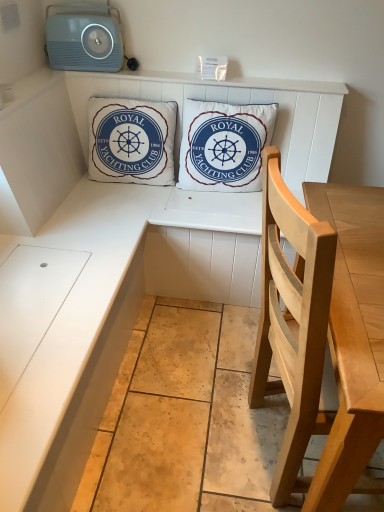
This screenshot has width=384, height=512. Describe the element at coordinates (131, 141) in the screenshot. I see `white cotton cushion at center, which ranks as the 2th pillow in right-to-left order` at that location.

The image size is (384, 512). What are the coordinates of `light wood chair at right` in the screenshot? It's located at (293, 324).

Describe the element at coordinates (293, 324) in the screenshot. Image resolution: width=384 pixels, height=512 pixels. I see `light wood chair at right` at that location.

In order to face light blue plastic stereo at upper left, should I rotate leftwards or rightwards?

You should rotate left by 14.283 degrees.

Locate an element on the screen. The width and height of the screenshot is (384, 512). white cotton cushion at center, the first pillow in the right-to-left sequence is located at coordinates (x=224, y=145).

Are light wood chair at right and white cotton cushion at center, which ranks as the 2th pillow in right-to-left order, making contact?

No, light wood chair at right is not in contact with white cotton cushion at center, which ranks as the 2th pillow in right-to-left order.

Could you tell me if light wood chair at right is facing white cotton cushion at center, which ranks as the 2th pillow in right-to-left order?

No, light wood chair at right is not turned towards white cotton cushion at center, which ranks as the 2th pillow in right-to-left order.

Is light wood chair at right bigger than white cotton cushion at center, marked as the 1th pillow in a left-to-right arrangement?

Yes, light wood chair at right is bigger than white cotton cushion at center, marked as the 1th pillow in a left-to-right arrangement.

Can you tell me how much light blue plastic stereo at upper left and white cotton cushion at center, the first pillow in the right-to-left sequence, differ in facing direction?

The facing directions of light blue plastic stereo at upper left and white cotton cushion at center, the first pillow in the right-to-left sequence, are 0.787 degrees apart.

Is light blue plastic stereo at upper left thinner than white cotton cushion at center, the first pillow in the right-to-left sequence?

Correct, the width of light blue plastic stereo at upper left is less than that of white cotton cushion at center, the first pillow in the right-to-left sequence.

Would you say light blue plastic stereo at upper left is a long distance from white cotton cushion at center, the first pillow in the right-to-left sequence?

light blue plastic stereo at upper left is actually quite close to white cotton cushion at center, the first pillow in the right-to-left sequence.

The width and height of the screenshot is (384, 512). Find the location of `stereo that is behind the white cotton cushion at center, the first pillow in the right-to-left sequence`. stereo that is behind the white cotton cushion at center, the first pillow in the right-to-left sequence is located at coordinates (84, 37).

Does point (52, 27) come closer to viewer compared to point (307, 377)?

No.

How distant is light blue plastic stereo at upper left from light wood chair at right?

light blue plastic stereo at upper left is 1.43 meters from light wood chair at right.

Looking at this image, is light blue plastic stereo at upper left oriented away from light wood chair at right?

No, light blue plastic stereo at upper left is not facing away from light wood chair at right.

Is light blue plastic stereo at upper left smaller than light wood chair at right?

Correct, light blue plastic stereo at upper left occupies less space than light wood chair at right.

Is light wood chair at right taller or shorter than white cotton cushion at center, the second pillow viewed from the left?

In the image, light wood chair at right appears to be taller than white cotton cushion at center, the second pillow viewed from the left.

Is light wood chair at right smaller than white cotton cushion at center, the first pillow in the right-to-left sequence?

No, light wood chair at right is not smaller than white cotton cushion at center, the first pillow in the right-to-left sequence.

Would you say light wood chair at right is to the left or to the right of white cotton cushion at center, the second pillow viewed from the left, in the picture?

Clearly, light wood chair at right is on the right of white cotton cushion at center, the second pillow viewed from the left, in the image.

Is the depth of light wood chair at right less than that of white cotton cushion at center, the first pillow in the right-to-left sequence?

Yes, it is in front of white cotton cushion at center, the first pillow in the right-to-left sequence.

What's the angular difference between light blue plastic stereo at upper left and white cotton cushion at center, marked as the 1th pillow in a left-to-right arrangement,'s facing directions?

The facing directions of light blue plastic stereo at upper left and white cotton cushion at center, marked as the 1th pillow in a left-to-right arrangement, are 2 degrees apart.

From a real-world perspective, which is physically below, light blue plastic stereo at upper left or white cotton cushion at center, which ranks as the 2th pillow in right-to-left order?

From a 3D spatial view, white cotton cushion at center, which ranks as the 2th pillow in right-to-left order, is below.

Are light blue plastic stereo at upper left and white cotton cushion at center, marked as the 1th pillow in a left-to-right arrangement, far apart?

Actually, light blue plastic stereo at upper left and white cotton cushion at center, marked as the 1th pillow in a left-to-right arrangement, are a little close together.

Image resolution: width=384 pixels, height=512 pixels. What are the coordinates of `the 1st pillow counting from the right side of the light blue plastic stereo at upper left` in the screenshot? It's located at (131, 141).

Does white cotton cushion at center, the second pillow viewed from the left, lie behind light blue plastic stereo at upper left?

No, white cotton cushion at center, the second pillow viewed from the left, is in front of light blue plastic stereo at upper left.

From the image's perspective, which one is positioned higher, white cotton cushion at center, the first pillow in the right-to-left sequence, or light blue plastic stereo at upper left?

light blue plastic stereo at upper left.

Considering the sizes of white cotton cushion at center, the first pillow in the right-to-left sequence, and light blue plastic stereo at upper left in the image, is white cotton cushion at center, the first pillow in the right-to-left sequence, bigger or smaller than light blue plastic stereo at upper left?

Considering their sizes, white cotton cushion at center, the first pillow in the right-to-left sequence, takes up more space than light blue plastic stereo at upper left.

Does point (262, 116) lie behind point (93, 60)?

No.

How distant is white cotton cushion at center, the first pillow in the right-to-left sequence, from white cotton cushion at center, which ranks as the 2th pillow in right-to-left order?

9.29 inches.

I want to click on pillow above the white cotton cushion at center, which ranks as the 2th pillow in right-to-left order (from a real-world perspective), so click(224, 145).

From the image's perspective, is white cotton cushion at center, the second pillow viewed from the left, beneath white cotton cushion at center, which ranks as the 2th pillow in right-to-left order?

Indeed, from the image's perspective, white cotton cushion at center, the second pillow viewed from the left, is shown beneath white cotton cushion at center, which ranks as the 2th pillow in right-to-left order.

Looking at this image, from a real-world perspective, is white cotton cushion at center, the first pillow in the right-to-left sequence, physically below white cotton cushion at center, which ranks as the 2th pillow in right-to-left order?

Actually, white cotton cushion at center, the first pillow in the right-to-left sequence, is physically above white cotton cushion at center, which ranks as the 2th pillow in right-to-left order, in the real world.

Find the location of a particular element. This screenshot has width=384, height=512. chair beneath the white cotton cushion at center, marked as the 1th pillow in a left-to-right arrangement (from a real-world perspective) is located at coordinates (293, 324).

Locate an element on the screen. This screenshot has width=384, height=512. stereo behind the white cotton cushion at center, the first pillow in the right-to-left sequence is located at coordinates (84, 37).

Looking at the image, which one is located further to light wood chair at right, white cotton cushion at center, the second pillow viewed from the left, or light blue plastic stereo at upper left?

The object further to light wood chair at right is light blue plastic stereo at upper left.

Based on their spatial positions, is light wood chair at right or white cotton cushion at center, marked as the 1th pillow in a left-to-right arrangement, further from white cotton cushion at center, the second pillow viewed from the left?

light wood chair at right is further to white cotton cushion at center, the second pillow viewed from the left.

Looking at the image, which one is located closer to white cotton cushion at center, marked as the 1th pillow in a left-to-right arrangement, light blue plastic stereo at upper left or light wood chair at right?

Among the two, light blue plastic stereo at upper left is located nearer to white cotton cushion at center, marked as the 1th pillow in a left-to-right arrangement.

When comparing their distances from white cotton cushion at center, the first pillow in the right-to-left sequence, does light wood chair at right or light blue plastic stereo at upper left seem further?

light wood chair at right is positioned further to the anchor white cotton cushion at center, the first pillow in the right-to-left sequence.

Estimate the real-world distances between objects in this image. Which object is closer to white cotton cushion at center, which ranks as the 2th pillow in right-to-left order, white cotton cushion at center, the first pillow in the right-to-left sequence, or light blue plastic stereo at upper left?

The object closer to white cotton cushion at center, which ranks as the 2th pillow in right-to-left order, is white cotton cushion at center, the first pillow in the right-to-left sequence.

Based on their spatial positions, is light blue plastic stereo at upper left or white cotton cushion at center, marked as the 1th pillow in a left-to-right arrangement, closer to light wood chair at right?

The object closer to light wood chair at right is white cotton cushion at center, marked as the 1th pillow in a left-to-right arrangement.

Considering their positions, is white cotton cushion at center, marked as the 1th pillow in a left-to-right arrangement, positioned closer to light wood chair at right than light blue plastic stereo at upper left?

white cotton cushion at center, marked as the 1th pillow in a left-to-right arrangement, is closer to light wood chair at right.

Which object lies further to the anchor point light blue plastic stereo at upper left, white cotton cushion at center, which ranks as the 2th pillow in right-to-left order, or white cotton cushion at center, the second pillow viewed from the left?

The object further to light blue plastic stereo at upper left is white cotton cushion at center, the second pillow viewed from the left.

Find the location of `pillow positioned between light wood chair at right and light blue plastic stereo at upper left from near to far`. pillow positioned between light wood chair at right and light blue plastic stereo at upper left from near to far is located at coordinates (224, 145).

The height and width of the screenshot is (512, 384). I want to click on stereo between light wood chair at right and white cotton cushion at center, which ranks as the 2th pillow in right-to-left order, from front to back, so click(84, 37).

The width and height of the screenshot is (384, 512). I want to click on pillow between light blue plastic stereo at upper left and white cotton cushion at center, the second pillow viewed from the left, from left to right, so click(131, 141).

Where is `pillow between light wood chair at right and white cotton cushion at center, which ranks as the 2th pillow in right-to-left order, along the z-axis`? The image size is (384, 512). pillow between light wood chair at right and white cotton cushion at center, which ranks as the 2th pillow in right-to-left order, along the z-axis is located at coordinates (224, 145).